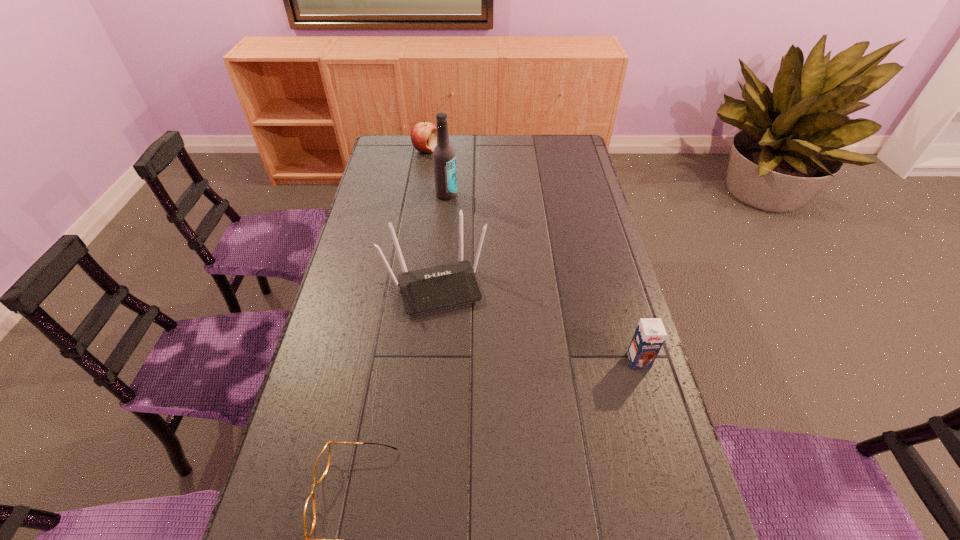
The height and width of the screenshot is (540, 960). Find the location of `chocolate milk`. chocolate milk is located at coordinates (650, 333).

Image resolution: width=960 pixels, height=540 pixels. Identify the location of the rightmost object. (650, 333).

At what (x,y) coordinates should I click in order to perform the action: click on the second farthest object. Please return your answer as a coordinate pair (x, y). This screenshot has height=540, width=960. Looking at the image, I should click on (444, 159).

You are a GUI agent. You are given a task and a screenshot of the screen. Output one action in this format:
    pyautogui.click(x=<x>, y=<y>)
    Task: Click on the beer bottle
    The width and height of the screenshot is (960, 540).
    Given the screenshot: What is the action you would take?
    pyautogui.click(x=444, y=159)

Find the location of a particular element. The width and height of the screenshot is (960, 540). the farthest object is located at coordinates pos(423,135).

In order to click on the second shortest object in this screenshot , I will do `click(423, 135)`.

The image size is (960, 540). I want to click on the second tallest object, so click(x=438, y=287).

The image size is (960, 540). I want to click on router, so click(438, 287).

At what (x,y) coordinates should I click in order to perform the action: click on vacant space located 0.120m on the front label of the rightmost object. Please return your answer as a coordinate pair (x, y). Looking at the image, I should click on (653, 410).

In order to click on vacant position located on the label of the tallest object in this screenshot , I will do [x=455, y=213].